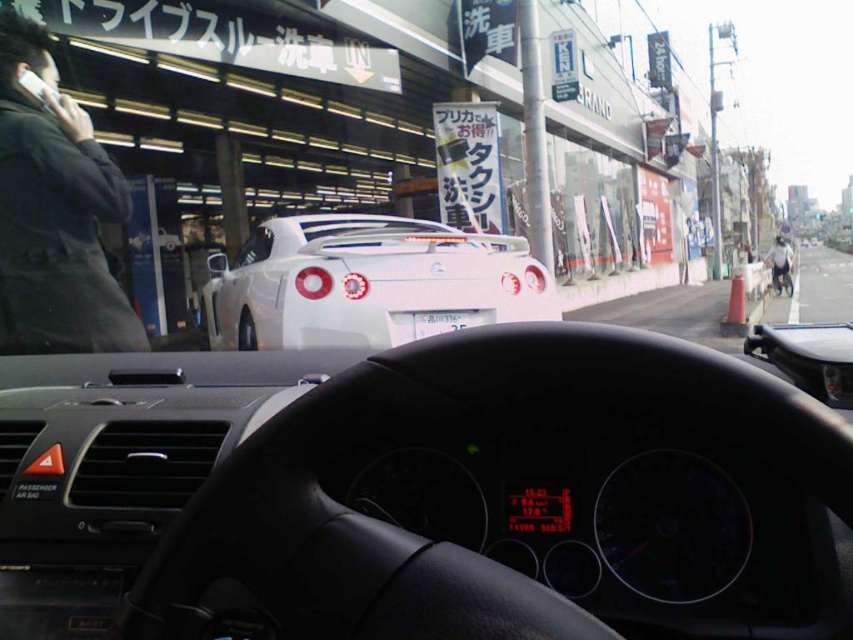
Question: Is black fabric jacket at left thinner than light gray fabric jacket at right?

Choices:
 (A) no
 (B) yes

Answer: (B)

Question: Based on their relative distances, which object is farther from the white glossy sports car at center?

Choices:
 (A) black plastic phone at upper left
 (B) white glossy license plate at center
 (C) black fabric jacket at left
 (D) light gray fabric jacket at right

Answer: (D)

Question: Which point is closer to the camera taking this photo?

Choices:
 (A) (791, 252)
 (B) (32, 193)
 (C) (55, 108)

Answer: (B)

Question: Which point appears closest to the camera in this image?

Choices:
 (A) (38, 81)
 (B) (271, 236)

Answer: (A)

Question: Can you confirm if white glossy sports car at center is positioned to the left of black fabric jacket at left?

Choices:
 (A) no
 (B) yes

Answer: (B)

Question: Is light gray fabric jacket at right to the left of black plastic phone at upper left from the viewer's perspective?

Choices:
 (A) no
 (B) yes

Answer: (A)